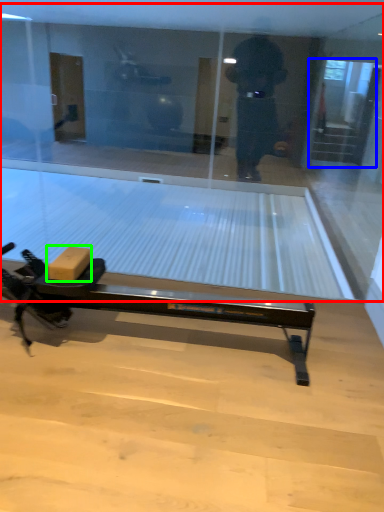
Question: Which object is the farthest from shop window (highlighted by a red box)? Choose among these: screen door (highlighted by a blue box) or cardboard box (highlighted by a green box).

Choices:
 (A) screen door
 (B) cardboard box

Answer: (A)